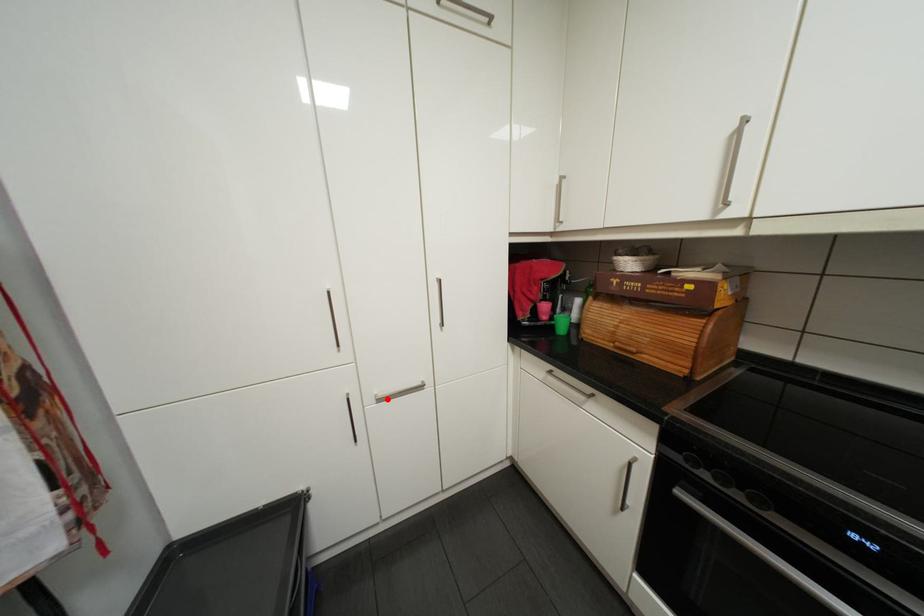
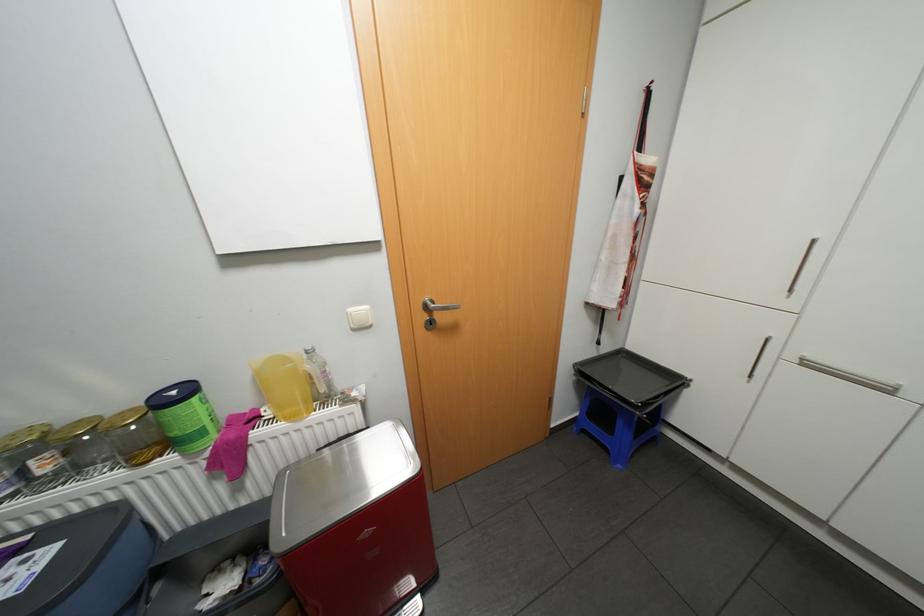
Find the pixel in the second image that matches the highlighted location in the first image.

(813, 363)